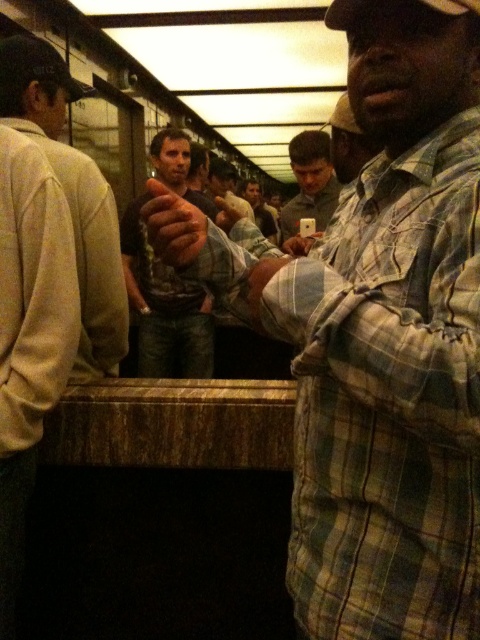
In the scene shown: Does dark brown leather wallet at center have a smaller size compared to matte black shirt at center?

Indeed, dark brown leather wallet at center has a smaller size compared to matte black shirt at center.

Is dark brown leather wallet at center thinner than matte black shirt at center?

No, dark brown leather wallet at center is not thinner than matte black shirt at center.

Locate an element on the screen. The image size is (480, 640). dark brown leather wallet at center is located at coordinates (164, 307).

Looking at this image, who is higher up, matte plaid shirt at center or matte black shirt at center?

matte black shirt at center is above.

Is point (312, 179) behind point (274, 225)?

No, (312, 179) is closer to viewer.

The image size is (480, 640). What do you see at coordinates (310, 182) in the screenshot?
I see `matte plaid shirt at center` at bounding box center [310, 182].

Where is `matte plaid shirt at center`? The image size is (480, 640). matte plaid shirt at center is located at coordinates (310, 182).

Does point (305, 476) lie in front of point (255, 196)?

Yes.

Does plaid shirt at center appear on the right side of matte black shirt at center?

Yes, plaid shirt at center is to the right of matte black shirt at center.

You are a GUI agent. You are given a task and a screenshot of the screen. Output one action in this format:
    pyautogui.click(x=<x>, y=<y>)
    Task: Click on the plaid shirt at center
    
    Given the screenshot: What is the action you would take?
    pyautogui.click(x=377, y=337)